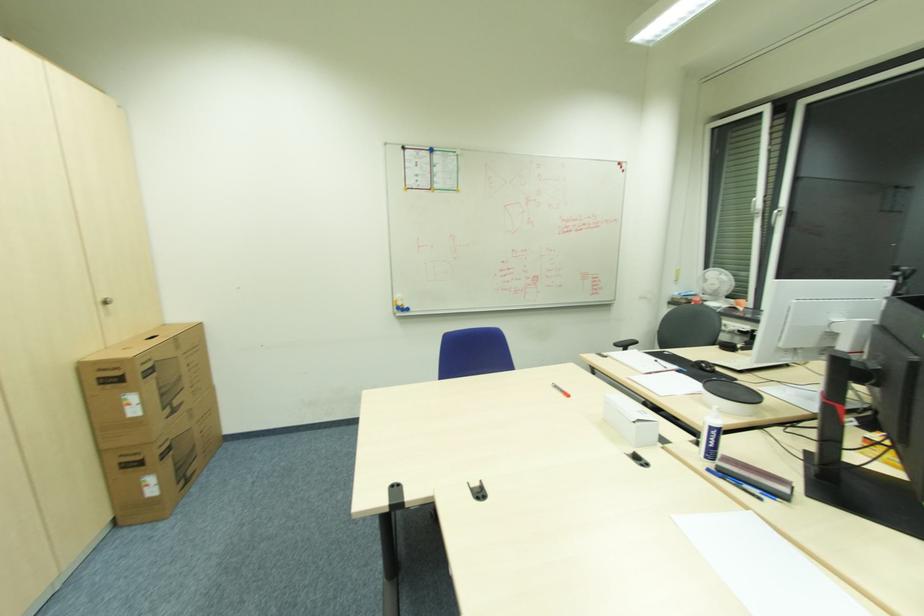
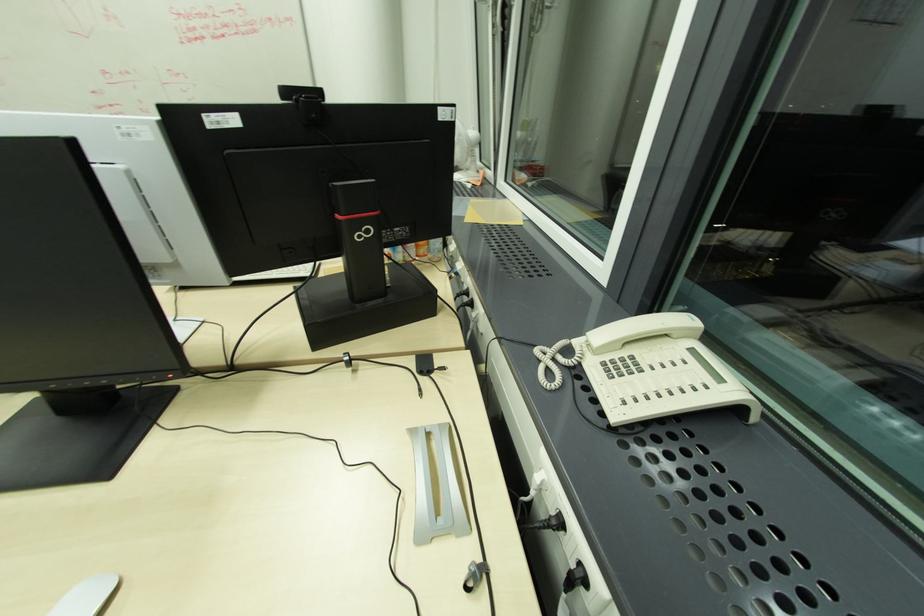
Question: Which direction would the cameraman need to move to produce the second image? Reply with the corresponding letter.

Choices:
 (A) Left
 (B) Right
 (C) Forward
 (D) Backward

Answer: (B)